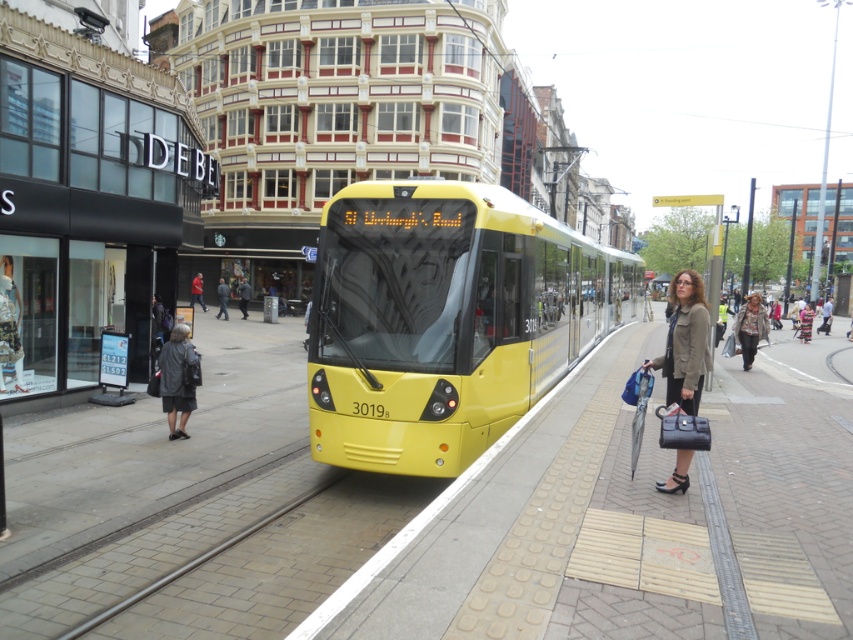
You are standing on the platform waiting for the tram. There are two points marked on the platform. The first point is at coordinates point [190,378] and the second point is at point [747,317]. Which point is closer to you?

Point [190,378] is in front of point [747,317], so it is closer to you.

You are standing on the platform and want to board the yellow tram labeled 3019. The tram doors are located at point [445,320]. Can you reach the doors from your current position at the edge of the platform?

The doors are located at point [445,320], which is the yellow matte bus at center. Since you are at the edge of the platform, you can walk towards the center to reach the doors of the yellow matte bus at center.